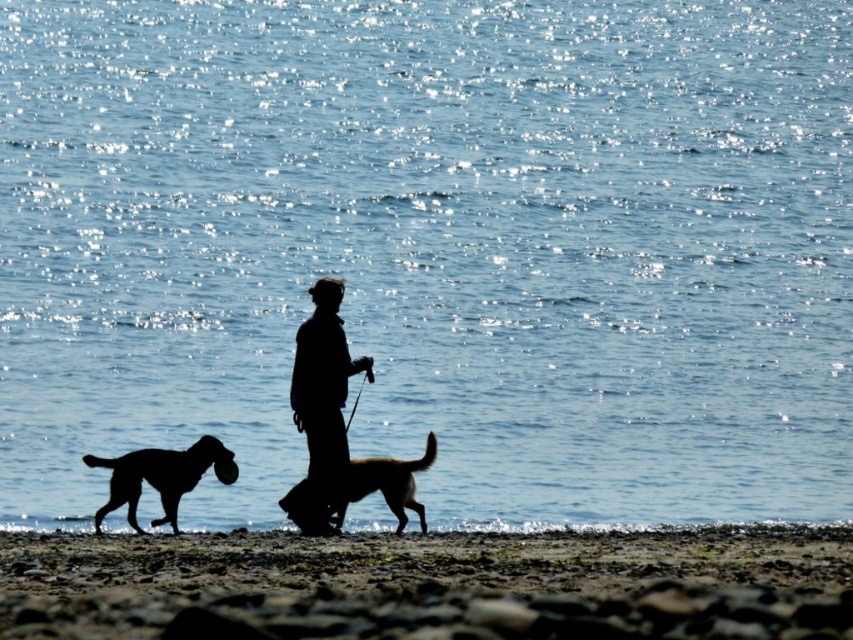
Between silhouette fabric at center and silhouette glossy dog at lower left, which one is positioned lower?

Positioned lower is silhouette glossy dog at lower left.

Between point (308, 470) and point (164, 497), which one is positioned behind?

The point (308, 470) is more distant.

At what (x,y) coordinates should I click in order to perform the action: click on silhouette fabric at center. Please return your answer as a coordinate pair (x, y). The width and height of the screenshot is (853, 640). Looking at the image, I should click on (323, 401).

Can you confirm if silhouette fabric at center is thinner than brown fur dog at center?

Indeed, silhouette fabric at center has a lesser width compared to brown fur dog at center.

Is point (312, 384) positioned after point (369, 460)?

Yes.

Find the location of a particular element. This screenshot has height=640, width=853. silhouette fabric at center is located at coordinates (323, 401).

Does point (726, 634) come in front of point (396, 515)?

Yes, point (726, 634) is in front of point (396, 515).

I want to click on rough sand beach at lower center, so click(428, 584).

Where is `rough sand beach at lower center`? This screenshot has height=640, width=853. rough sand beach at lower center is located at coordinates (428, 584).